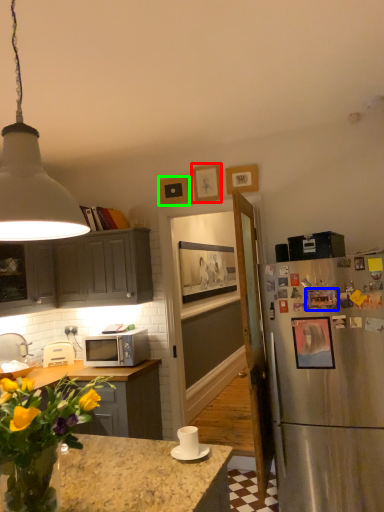
Question: Considering the real-world distances, which object is farthest from picture frame (highlighted by a red box)? picture frame (highlighted by a blue box) or picture frame (highlighted by a green box)?

Choices:
 (A) picture frame
 (B) picture frame

Answer: (A)